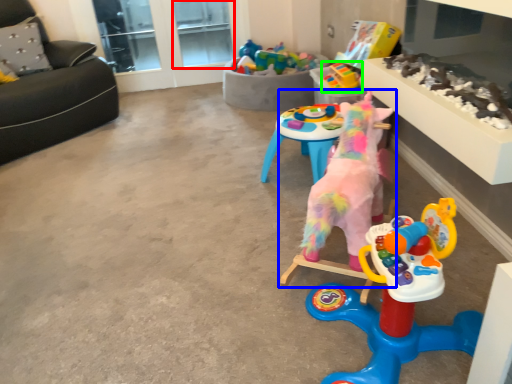
Question: Which is nearer to the window screen (highlighted by a red box)? toy (highlighted by a blue box) or toy (highlighted by a green box).

Choices:
 (A) toy
 (B) toy

Answer: (B)